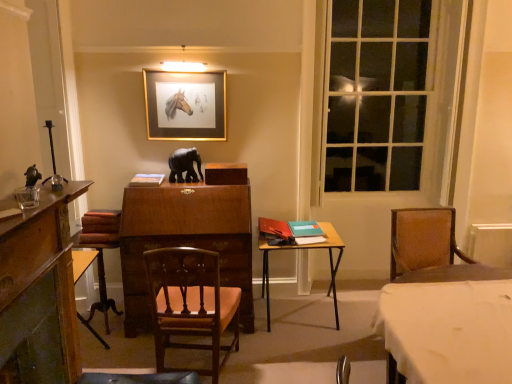
Question: Considering the relative positions of wooden chair at center and white cloth-covered table at lower right, the 2th table viewed from the left, in the image provided, is wooden chair at center to the left or to the right of white cloth-covered table at lower right, the 2th table viewed from the left,?

Choices:
 (A) right
 (B) left

Answer: (B)

Question: Is wooden chair at center bigger or smaller than white cloth-covered table at lower right, which is counted as the second table, starting from the back?

Choices:
 (A) small
 (B) big

Answer: (A)

Question: Which of these objects is positioned closest to the wooden chair at center?

Choices:
 (A) white cloth-covered table at lower right, the 2th table viewed from the left
 (B) matte black elephant at center
 (C) clear glass window at right
 (D) gold-framed picture at upper center
 (E) brown wood swivel chair at lower left

Answer: (E)

Question: Based on their relative distances, which object is nearer to the matte black elephant at center?

Choices:
 (A) gold-framed picture at upper center
 (B) white cloth-covered table at lower right, the first table from the front
 (C) clear glass window at right
 (D) wooden table at center, which appears as the first table when viewed from the back
 (E) wooden chair at center

Answer: (A)